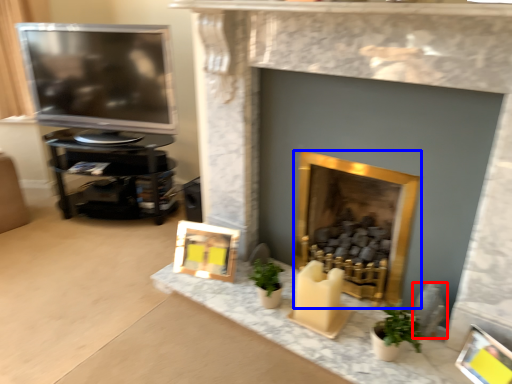
Question: Which point is further to the camera, gray (highlighted by a red box) or fireplace (highlighted by a blue box)?

Choices:
 (A) gray
 (B) fireplace

Answer: (A)